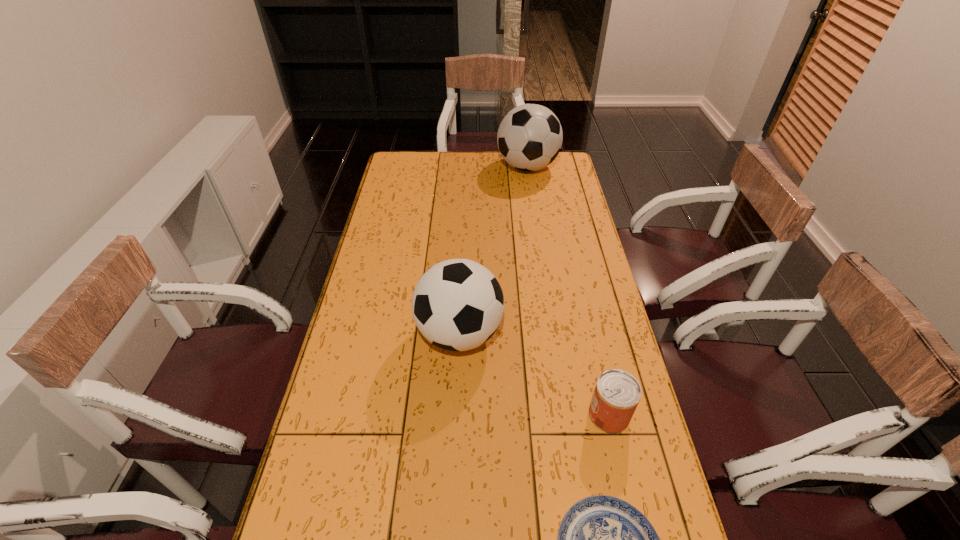
In order to click on free space between the right soccer ball and the can in this screenshot , I will do `click(568, 291)`.

Locate an element on the screen. This screenshot has width=960, height=540. free spot between the right soccer ball and the third farthest object is located at coordinates (568, 291).

Find the location of a particular element. free space between the can and the left soccer ball is located at coordinates (534, 374).

Where is `object that stands as the closest to the nearest object`? The width and height of the screenshot is (960, 540). object that stands as the closest to the nearest object is located at coordinates (617, 393).

Select which object is the second closest to the second shortest object. Please provide its 2D coordinates. Your answer should be formatted as a tuple, i.e. [(x, y)], where the tuple contains the x and y coordinates of a point satisfying the conditions above.

[(458, 304)]

The width and height of the screenshot is (960, 540). Identify the location of free space that satisfies the following two spatial constraints: 1. on the front side of the farthest object; 2. on the left side of the second nearest object. (564, 415).